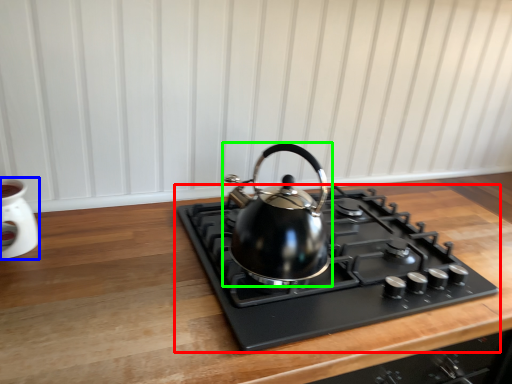
Question: Which object is positioned farthest from gas stove (highlighted by a red box)? Select from appliance (highlighted by a blue box) and kettle (highlighted by a green box).

Choices:
 (A) appliance
 (B) kettle

Answer: (A)